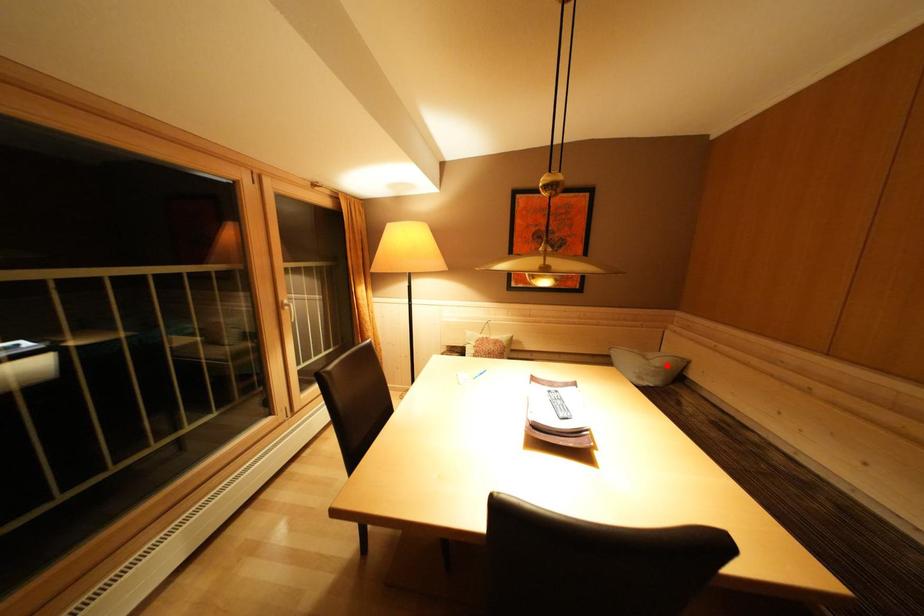
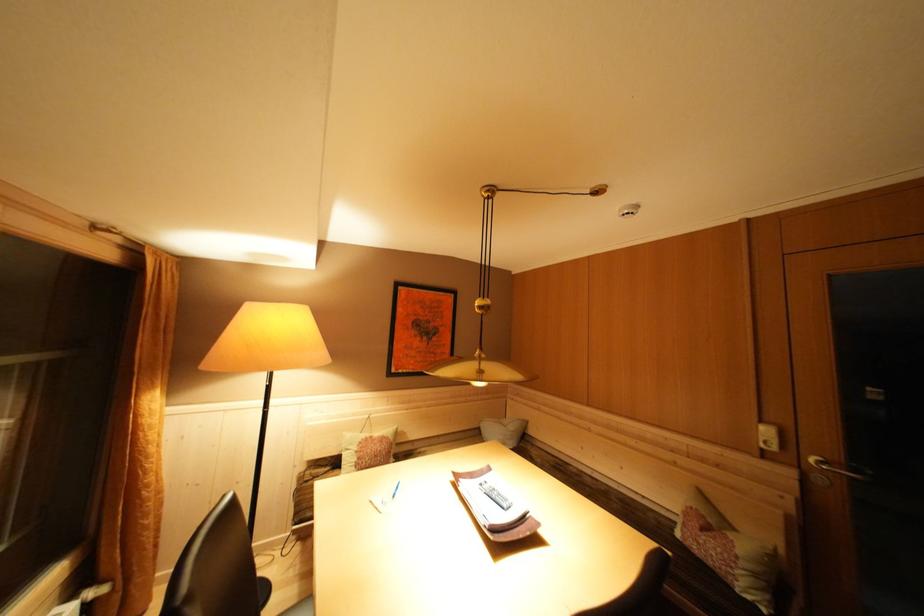
Locate, in the second image, the point that corresponds to the highlighted location in the first image.

(518, 430)